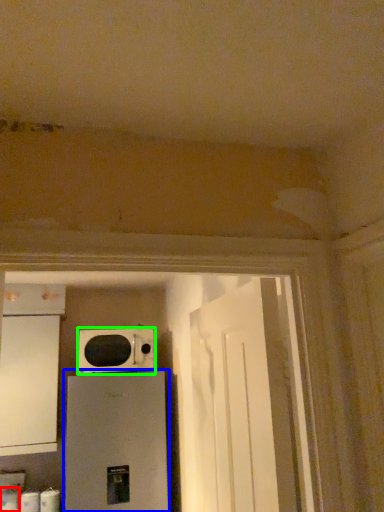
Question: Estimate the real-world distances between objects in this image. Which object is farther from toilet paper (highlighted by a red box), home appliance (highlighted by a blue box) or microwave oven (highlighted by a green box)?

Choices:
 (A) home appliance
 (B) microwave oven

Answer: (B)